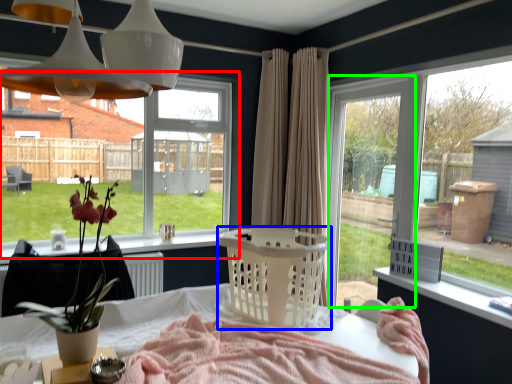
Question: Which object is the closest to the window (highlighted by a red box)? Choose among these: basket (highlighted by a blue box) or window frame (highlighted by a green box).

Choices:
 (A) basket
 (B) window frame

Answer: (B)